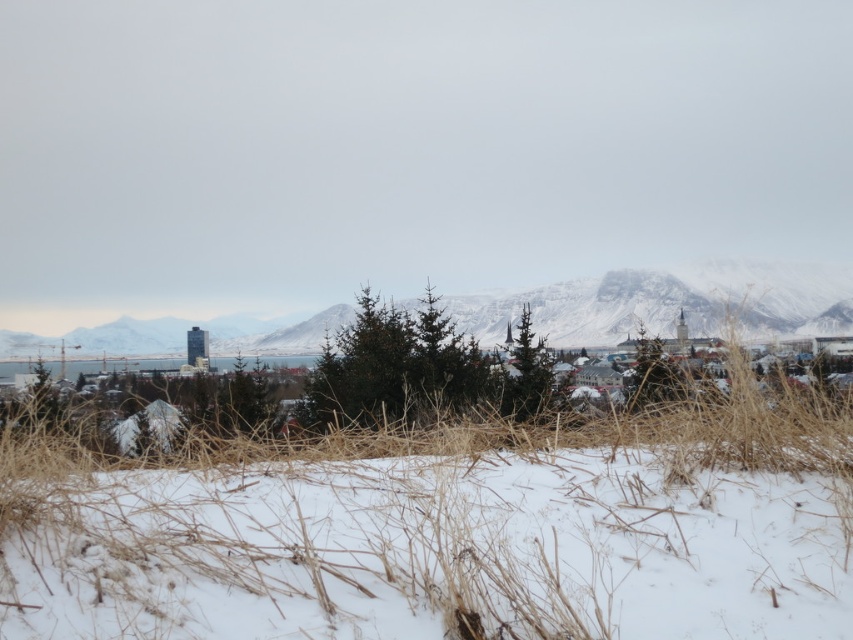
You are an explorer trying to cross the snowy field. You see the white dry grass at center and the snowy rock formation at center. Which one is located to the left when facing the scene?

The white dry grass at center is positioned on the left side of snowy rock formation at center, so the white dry grass at center is located to the left.

You are a hiker trying to navigate through the snowy field. You see the white dry grass at center and the snowy rock formation at center. Which one is closer to you?

The distance between the white dry grass at center and the snowy rock formation at center is 105.10 meters, so they are both at the same distance from you since they are at the center of the scene.